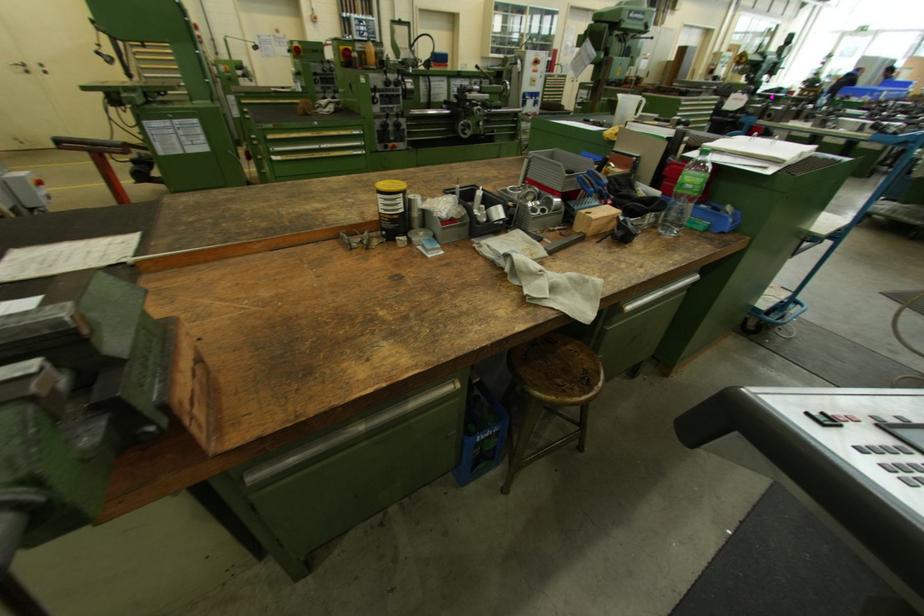
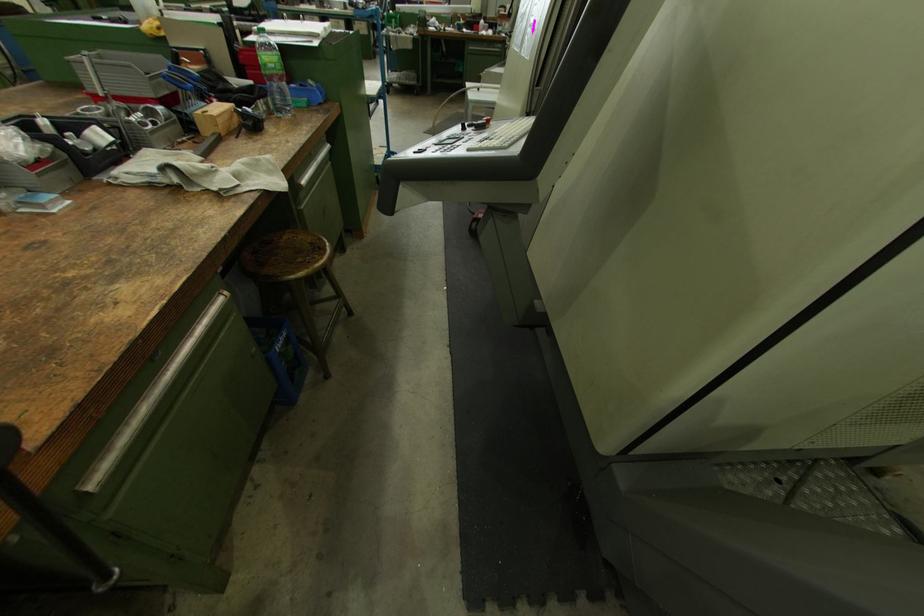
In the second image, find the point that corresponds to (503,430) in the first image.

(290, 334)